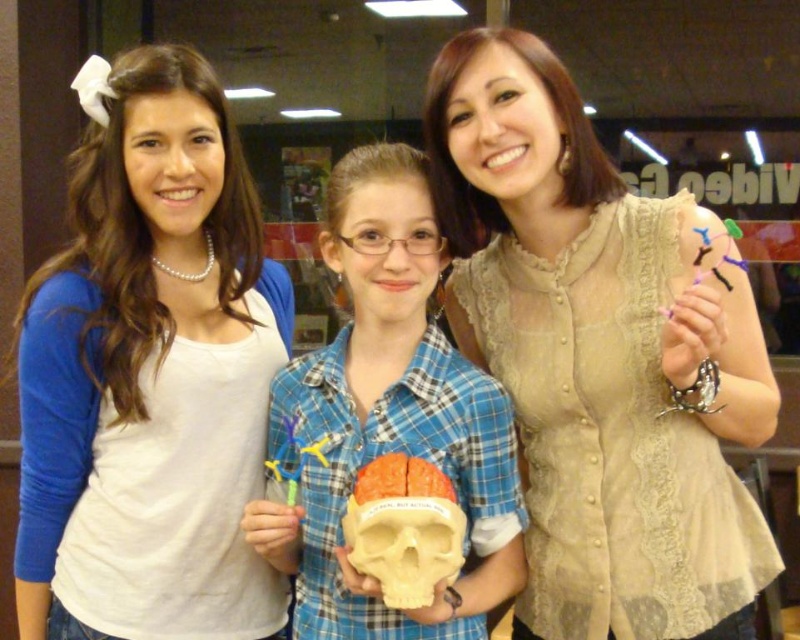
Question: Considering the real-world distances, which object is farthest from the matte plastic skull at center?

Choices:
 (A) beige lace blouse at center
 (B) orange matte skull at center
 (C) white pearl necklace at upper left

Answer: (C)

Question: Is beige lace blouse at center thinner than matte plastic skull at center?

Choices:
 (A) no
 (B) yes

Answer: (A)

Question: Is beige lace blouse at center further to camera compared to white pearl necklace at upper left?

Choices:
 (A) yes
 (B) no

Answer: (B)

Question: Where is white pearl necklace at upper left located in relation to matte plastic skull at center in the image?

Choices:
 (A) right
 (B) left

Answer: (B)

Question: Which of the following is the closest to the observer?

Choices:
 (A) beige lace blouse at center
 (B) orange matte skull at center
 (C) white pearl necklace at upper left

Answer: (A)

Question: Which point is farther from the camera taking this photo?

Choices:
 (A) (334, 474)
 (B) (704, 371)
 (C) (445, 564)
 (D) (196, 115)

Answer: (D)